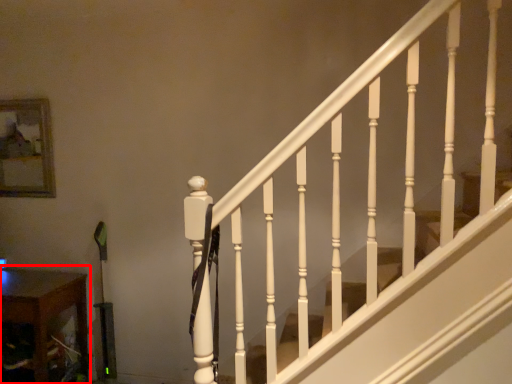
Question: From the image's perspective, where is table (annotated by the red box) located relative to picture frame?

Choices:
 (A) below
 (B) above

Answer: (A)